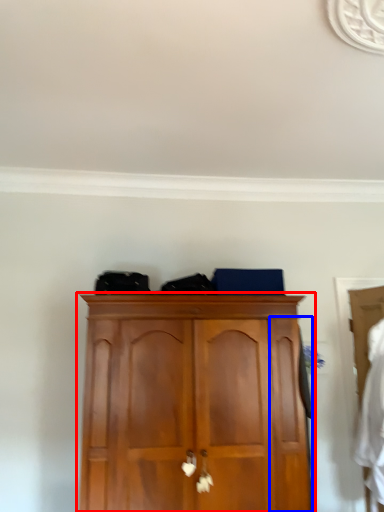
Question: Among these objects, which one is farthest to the camera, cupboard (highlighted by a red box) or door (highlighted by a blue box)?

Choices:
 (A) cupboard
 (B) door

Answer: (B)